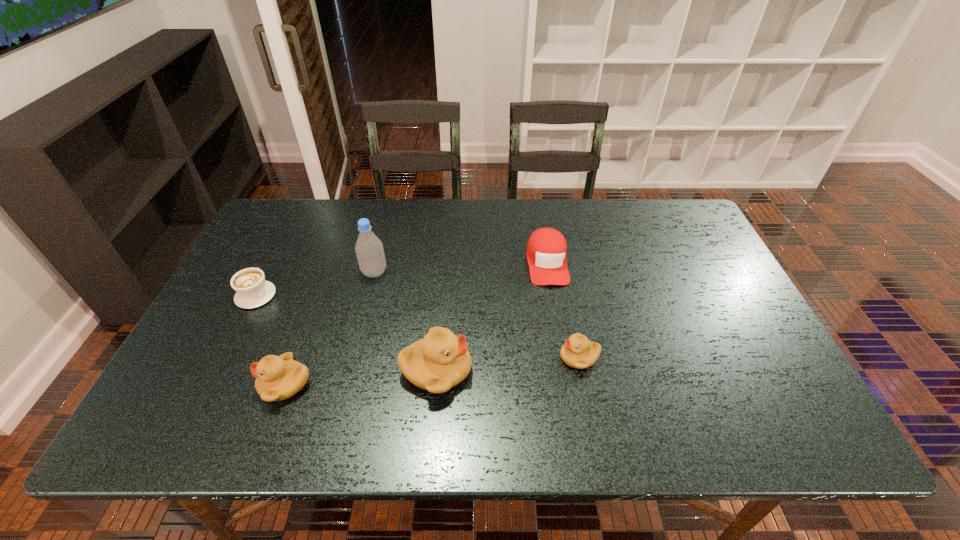
Find the location of a particular element. The image size is (960, 540). free location located at the beak of the second tallest duckling is located at coordinates (237, 384).

You are a GUI agent. You are given a task and a screenshot of the screen. Output one action in this format:
    pyautogui.click(x=<x>, y=<y>)
    Task: Click on the vacant region located at the beak of the tallest duckling
    Image resolution: width=960 pixels, height=540 pixels.
    Given the screenshot: What is the action you would take?
    pyautogui.click(x=588, y=370)

You are a GUI agent. You are given a task and a screenshot of the screen. Output one action in this format:
    pyautogui.click(x=<x>, y=<y>)
    Task: Click on the vacant space located at the beak of the rightmost duckling
    This screenshot has height=540, width=960.
    Given the screenshot: What is the action you would take?
    pyautogui.click(x=464, y=357)

At what (x,y) coordinates should I click in order to perform the action: click on vacant point located at the beak of the rightmost duckling. Please return your answer as a coordinate pair (x, y). This screenshot has width=960, height=540. Looking at the image, I should click on (530, 357).

At what (x,y) coordinates should I click in order to perform the action: click on vacant space located 0.290m at the beak of the rightmost duckling. Please return your answer as a coordinate pair (x, y). This screenshot has width=960, height=540. Looking at the image, I should click on (439, 357).

Locate an element on the screen. The width and height of the screenshot is (960, 540). free space located 0.280m on the front-facing side of the baseball cap is located at coordinates (564, 373).

The image size is (960, 540). In order to click on free spot located 0.060m on the back of the tallest object in this screenshot , I will do `click(380, 251)`.

The image size is (960, 540). In order to click on vacant space located 0.090m to the right of the cappuccino's handle in this screenshot , I will do `click(274, 259)`.

The width and height of the screenshot is (960, 540). Identify the location of free location located to the right of the cappuccino's handle. (276, 255).

At what (x,y) coordinates should I click in order to perform the action: click on vacant space located 0.260m to the right of the cappuccino's handle. Please return your answer as a coordinate pair (x, y). Looking at the image, I should click on [x=291, y=225].